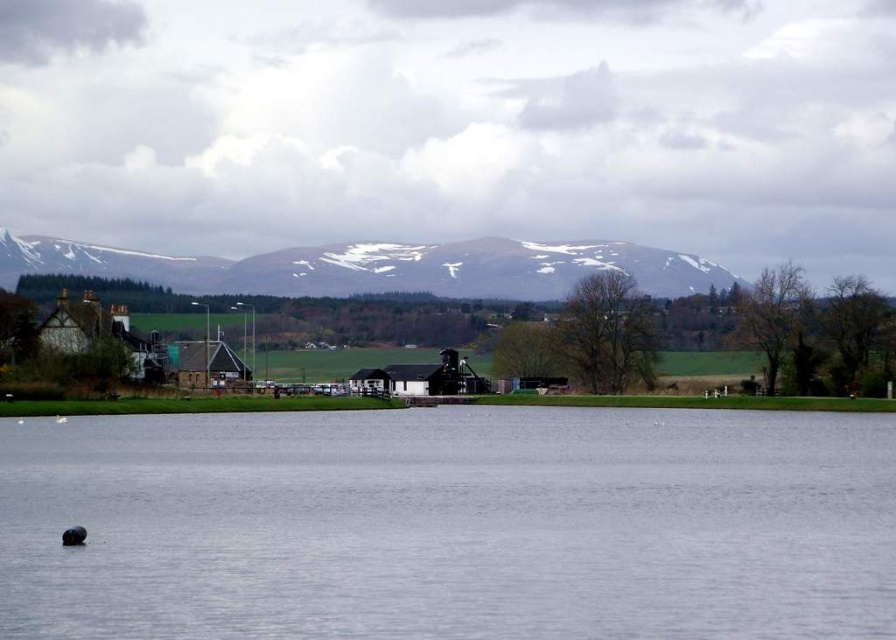
Describe the element at coordinates (450, 525) in the screenshot. I see `clear water at center` at that location.

This screenshot has height=640, width=896. I want to click on clear water at center, so [x=450, y=525].

Identify the location of clear water at center. This screenshot has height=640, width=896. (450, 525).